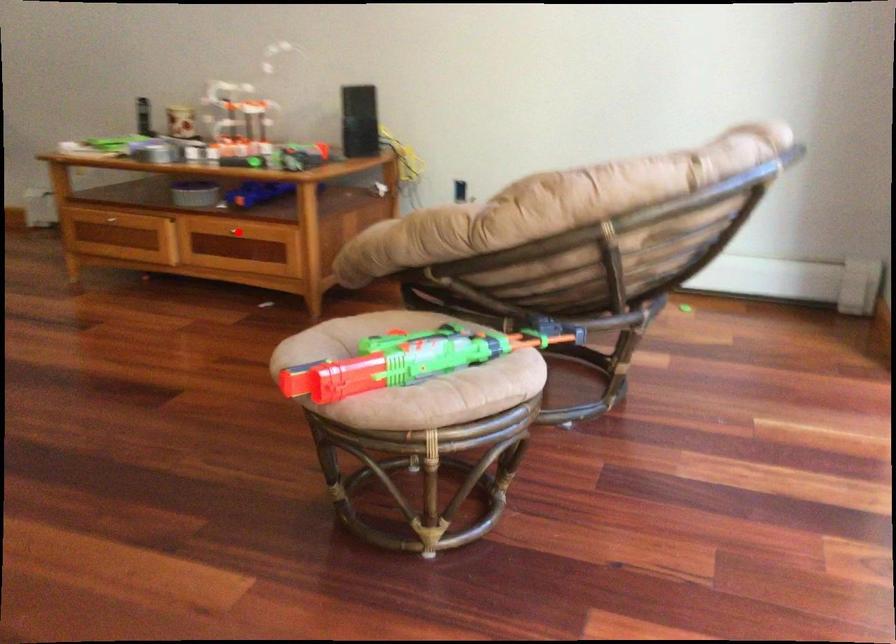
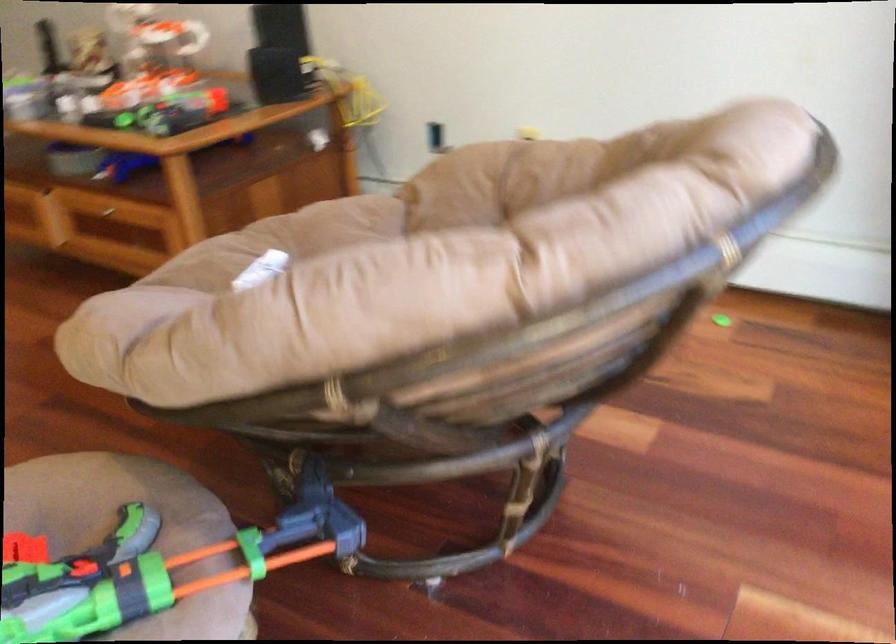
Question: I am providing you with two images of the same scene from different viewpoints. A red point is shown in image1. For the corresponding object point in image2, is it positioned nearer or farther from the camera?

Choices:
 (A) Nearer
 (B) Farther

Answer: (A)